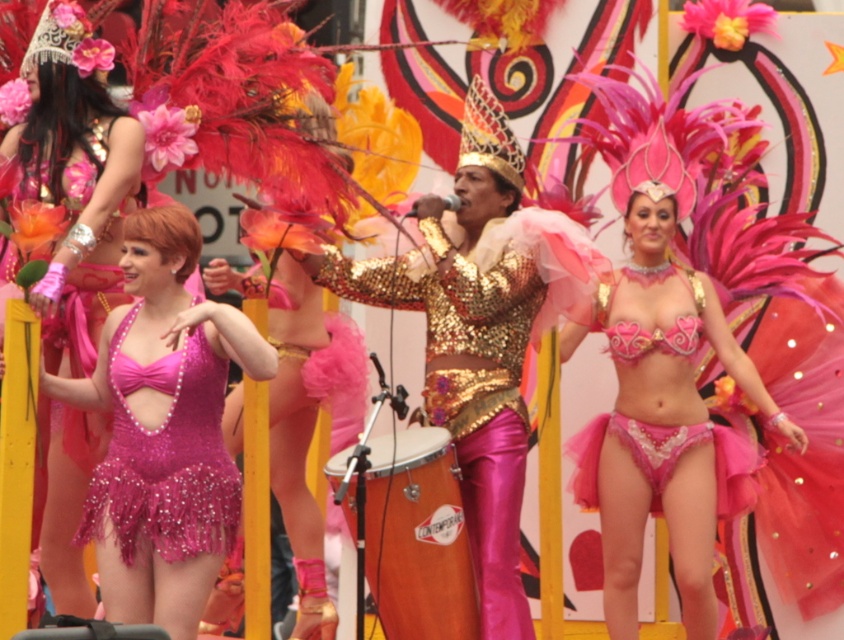
You are a photographer standing at the back of the event venue. You want to take a closeup shot of the shiny sequined dress at left. Given that your camera has a maximum zoom range of 50 meters, can you capture the dress clearly?

The shiny sequined dress at left is 56.76 meters away from viewer. Since the camera can only zoom up to 50 meters, it won not be able to capture the dress clearly.

You are a photographer at the event and want to capture a photo that shows both the shiny sequined dress at left and the pink sequined bikini at upper left. However, your camera has a limited focus range. Which of the two items is closer to the camera so you can ensure it stays in focus?

The shiny sequined dress at left is closer to the camera than the pink sequined bikini at upper left because it is shorter, so focusing on it would keep it sharp.